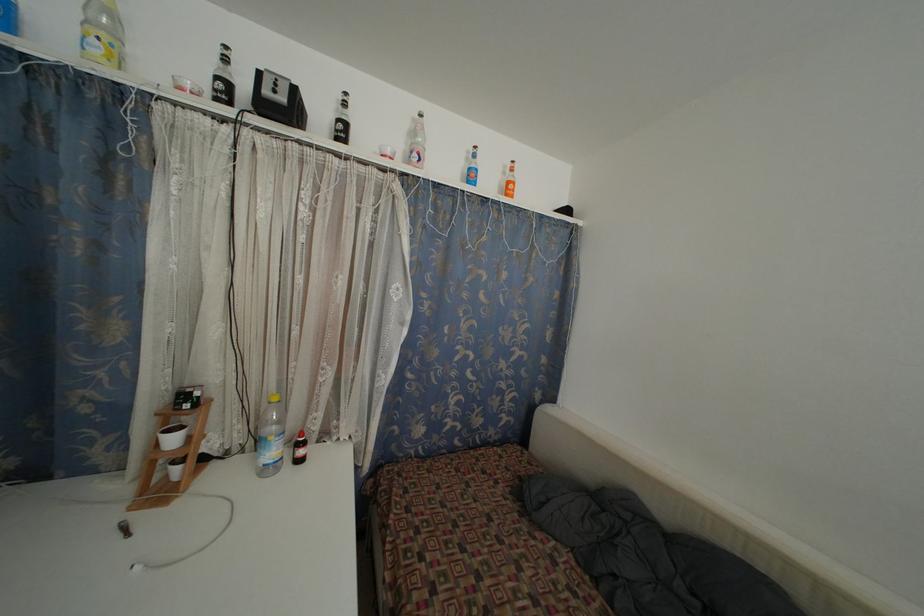
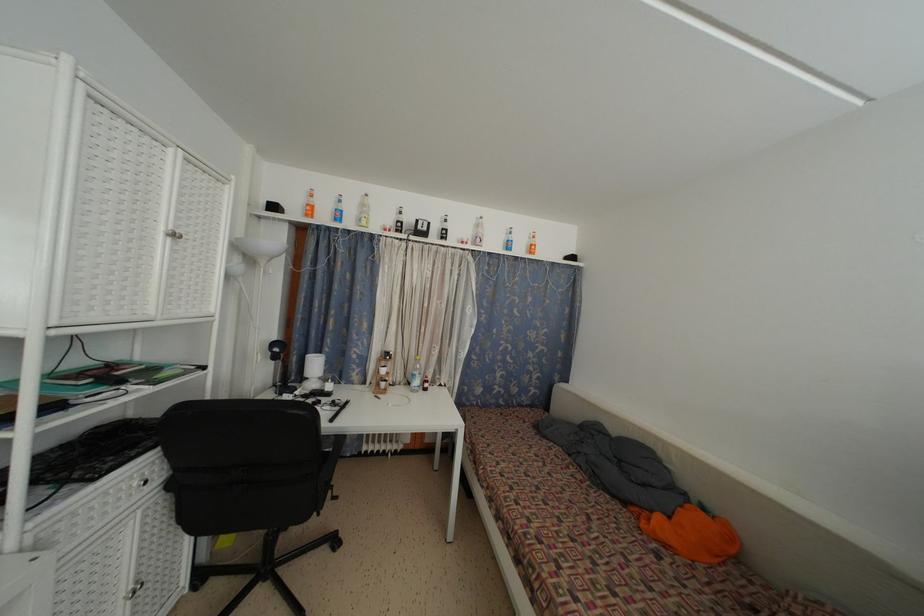
The point at (x=507, y=179) is marked in the first image. Where is the corresponding point in the second image?

(533, 244)